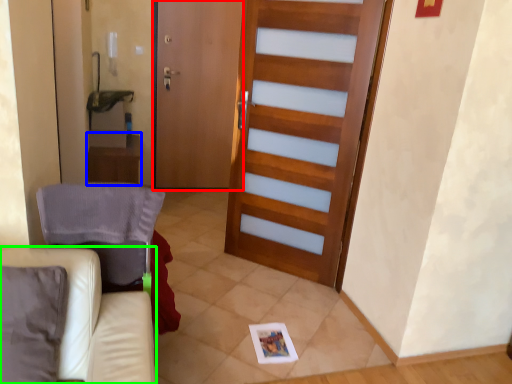
Question: Based on their relative distances, which object is farther from screen door (highlighted by a red box)? Choose from table (highlighted by a blue box) and furniture (highlighted by a green box).

Choices:
 (A) table
 (B) furniture

Answer: (B)